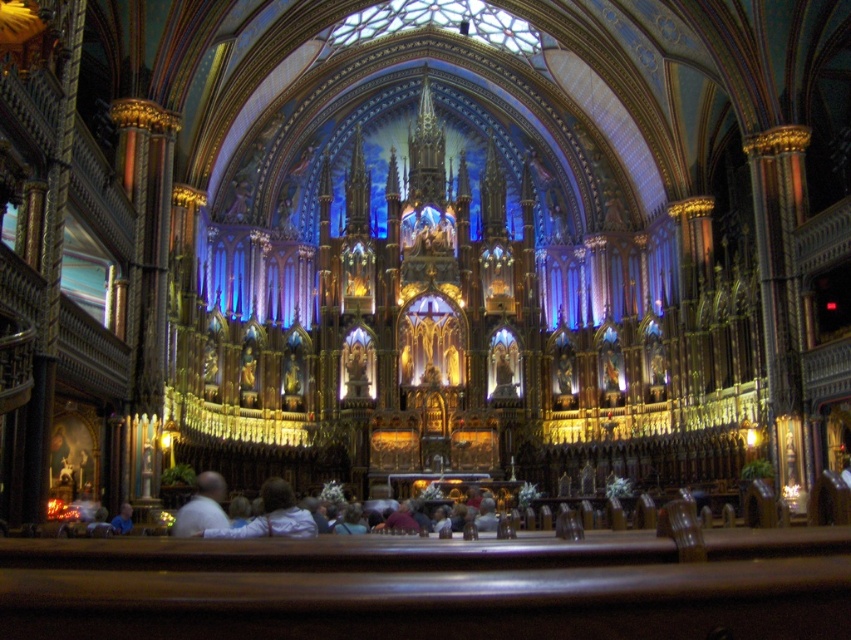
Who is taller, white matte shirt at lower center or light blue shirt at lower left?

white matte shirt at lower center is taller.

Can you confirm if white matte shirt at lower center is positioned to the left of light blue shirt at lower left?

In fact, white matte shirt at lower center is to the right of light blue shirt at lower left.

Locate an element on the screen. Image resolution: width=851 pixels, height=640 pixels. white matte shirt at lower center is located at coordinates (203, 506).

Can you confirm if light blue shirt at lower center is positioned above light blue shirt at lower left?

Yes.

Who is positioned more to the right, light blue shirt at lower center or light blue shirt at lower left?

Positioned to the right is light blue shirt at lower center.

The image size is (851, 640). I want to click on light blue shirt at lower center, so click(272, 516).

Can you confirm if light blue shirt at lower center is smaller than white matte shirt at lower center?

No.

Is light blue shirt at lower center to the left of white matte shirt at lower center from the viewer's perspective?

No, light blue shirt at lower center is not to the left of white matte shirt at lower center.

Is point (290, 531) in front of point (210, 496)?

Yes, point (290, 531) is closer to viewer.

You are a GUI agent. You are given a task and a screenshot of the screen. Output one action in this format:
    pyautogui.click(x=<x>, y=<y>)
    Task: Click on the light blue shirt at lower center
    This screenshot has height=640, width=851.
    Given the screenshot: What is the action you would take?
    pyautogui.click(x=272, y=516)